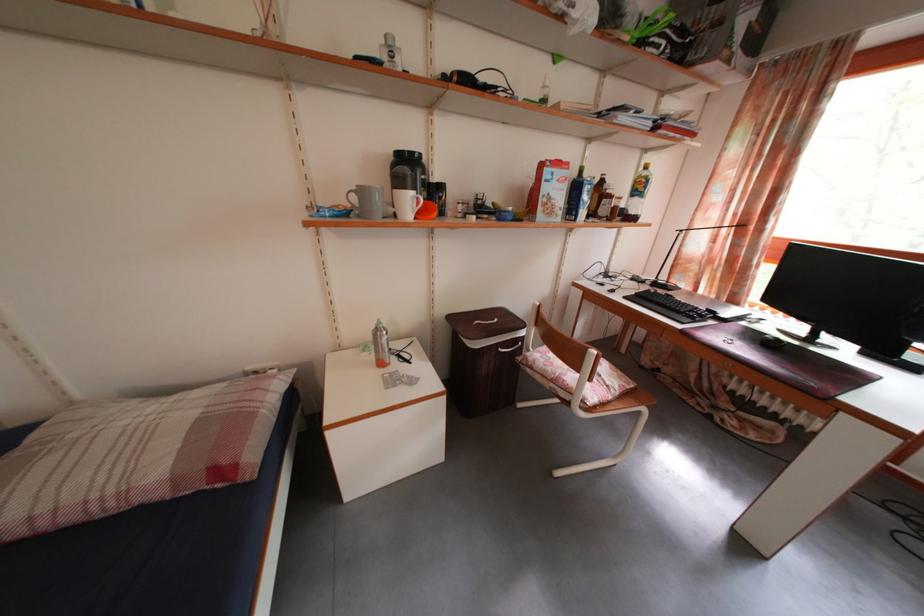
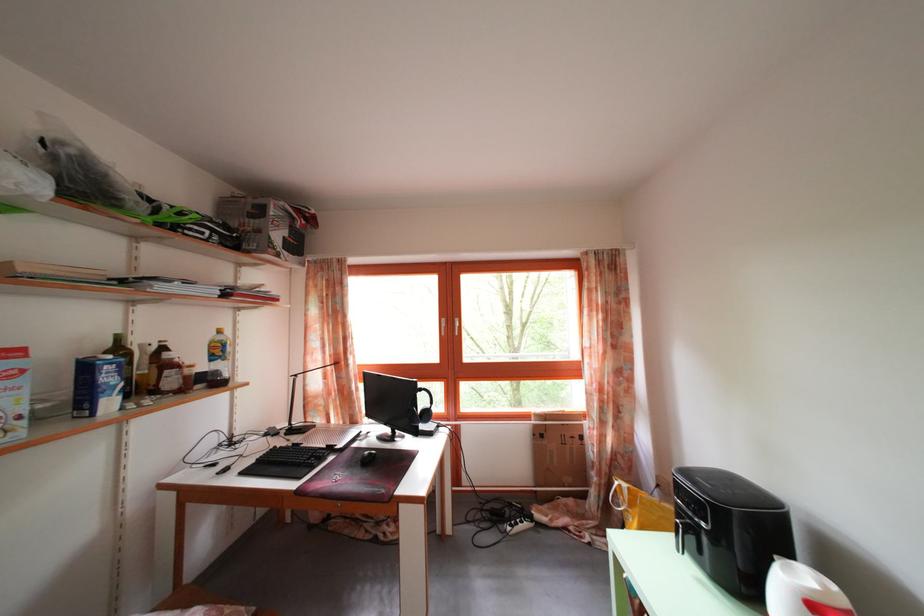
Find the pixel in the second image that matches [686,320] in the first image.

(307, 472)